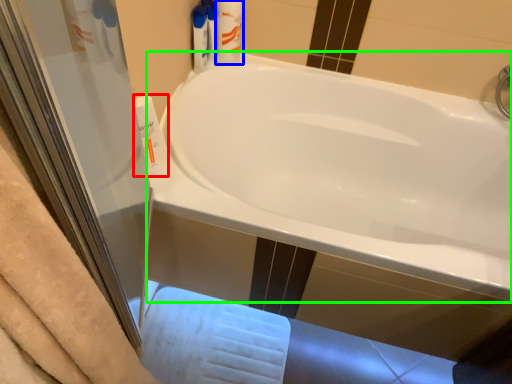
Question: Which is farther away from cleaning product (highlighted by a red box)? toiletry (highlighted by a blue box) or bathtub (highlighted by a green box)?

Choices:
 (A) toiletry
 (B) bathtub

Answer: (B)